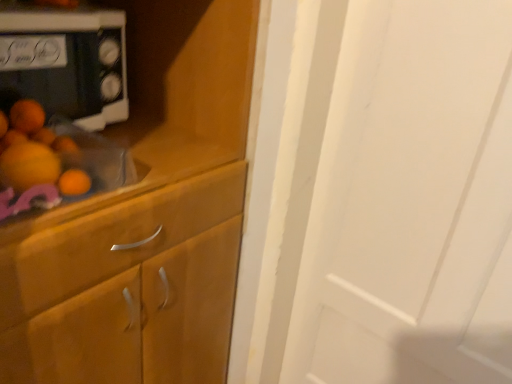
Find the location of a particular element. The image size is (512, 384). free spot to the right of white glossy microwave at upper left is located at coordinates (150, 145).